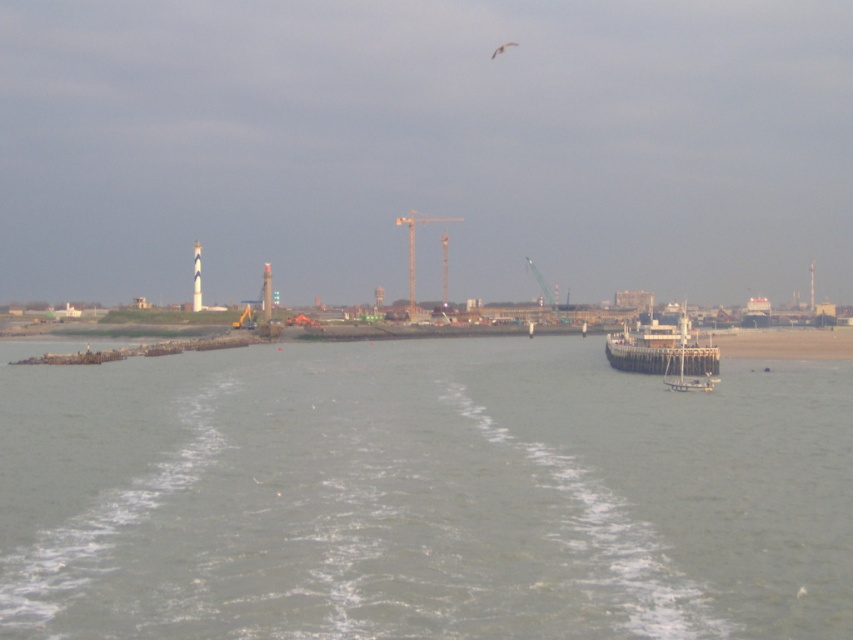
Does white wooden ship at center have a greater height compared to metallic yellow crane at center?

No, white wooden ship at center is not taller than metallic yellow crane at center.

Which is behind, point (624, 332) or point (408, 260)?

Positioned behind is point (408, 260).

Who is more distant from viewer, (709, 376) or (413, 241)?

Positioned behind is point (413, 241).

This screenshot has height=640, width=853. I want to click on white wooden ship at center, so click(x=664, y=355).

Consider the image. Is gray water at center to the right of white wooden ship at center from the viewer's perspective?

No, gray water at center is not to the right of white wooden ship at center.

Based on the photo, can you confirm if gray water at center is wider than white wooden ship at center?

Indeed, gray water at center has a greater width compared to white wooden ship at center.

Who is more forward, (x=120, y=566) or (x=717, y=364)?

Point (x=120, y=566) is more forward.

Locate an element on the screen. gray water at center is located at coordinates (421, 496).

Does gray water at center appear over metallic yellow crane at center?

Actually, gray water at center is below metallic yellow crane at center.

Which is above, gray water at center or metallic yellow crane at center?

Positioned higher is metallic yellow crane at center.

This screenshot has height=640, width=853. What are the coordinates of `gray water at center` in the screenshot? It's located at (421, 496).